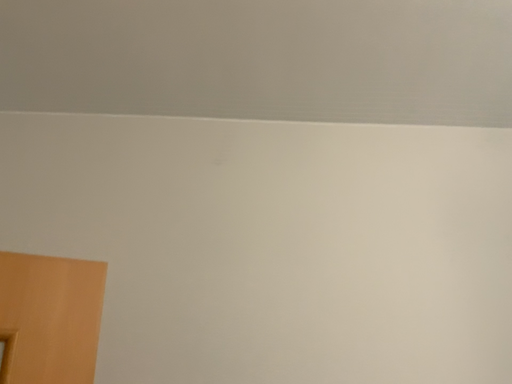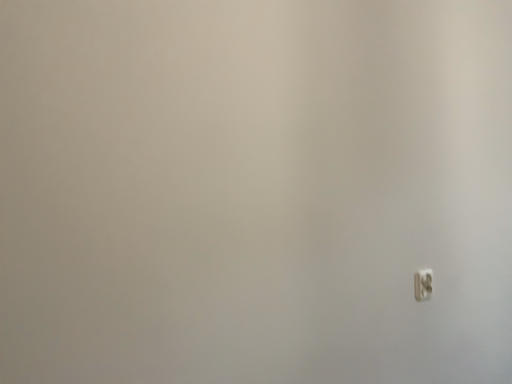
Question: How did the camera likely rotate when shooting the video?

Choices:
 (A) rotated left
 (B) rotated right

Answer: (B)